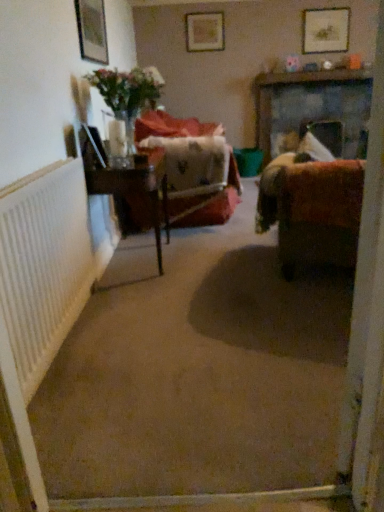
Question: From the image's perspective, is wooden picture frame at upper center, marked as the 3th picture frame in a front-to-back arrangement, located beneath velvet brown couch at right?

Choices:
 (A) no
 (B) yes

Answer: (A)

Question: Considering the relative sizes of wooden picture frame at upper center, positioned as the second picture frame in right-to-left order, and velvet brown couch at right in the image provided, is wooden picture frame at upper center, positioned as the second picture frame in right-to-left order, shorter than velvet brown couch at right?

Choices:
 (A) yes
 (B) no

Answer: (A)

Question: Is wooden picture frame at upper center, which is the 1th picture frame in back-to-front order, thinner than velvet brown couch at right?

Choices:
 (A) no
 (B) yes

Answer: (B)

Question: Can you confirm if wooden picture frame at upper center, positioned as the second picture frame in right-to-left order, is taller than velvet brown couch at right?

Choices:
 (A) no
 (B) yes

Answer: (A)

Question: Could you tell me if wooden picture frame at upper center, the second picture frame positioned from the bottom, is turned towards velvet brown couch at right?

Choices:
 (A) no
 (B) yes

Answer: (B)

Question: Can you confirm if wooden picture frame at upper center, the second picture frame positioned from the bottom, is smaller than velvet brown couch at right?

Choices:
 (A) no
 (B) yes

Answer: (B)

Question: Does translucent glass vase at left come in front of velvet-like red chair at center?

Choices:
 (A) yes
 (B) no

Answer: (A)

Question: Does translucent glass vase at left have a greater height compared to velvet-like red chair at center?

Choices:
 (A) no
 (B) yes

Answer: (A)

Question: Does translucent glass vase at left touch velvet-like red chair at center?

Choices:
 (A) yes
 (B) no

Answer: (B)

Question: Would you consider translucent glass vase at left to be distant from velvet-like red chair at center?

Choices:
 (A) yes
 (B) no

Answer: (B)

Question: From a real-world perspective, is translucent glass vase at left over velvet-like red chair at center?

Choices:
 (A) yes
 (B) no

Answer: (A)

Question: Could you tell me if translucent glass vase at left is facing velvet-like red chair at center?

Choices:
 (A) yes
 (B) no

Answer: (B)

Question: Can you confirm if translucent glass vase at upper left is wider than wooden picture frame at upper right, which appears as the 2th picture frame when viewed from the back?

Choices:
 (A) no
 (B) yes

Answer: (B)